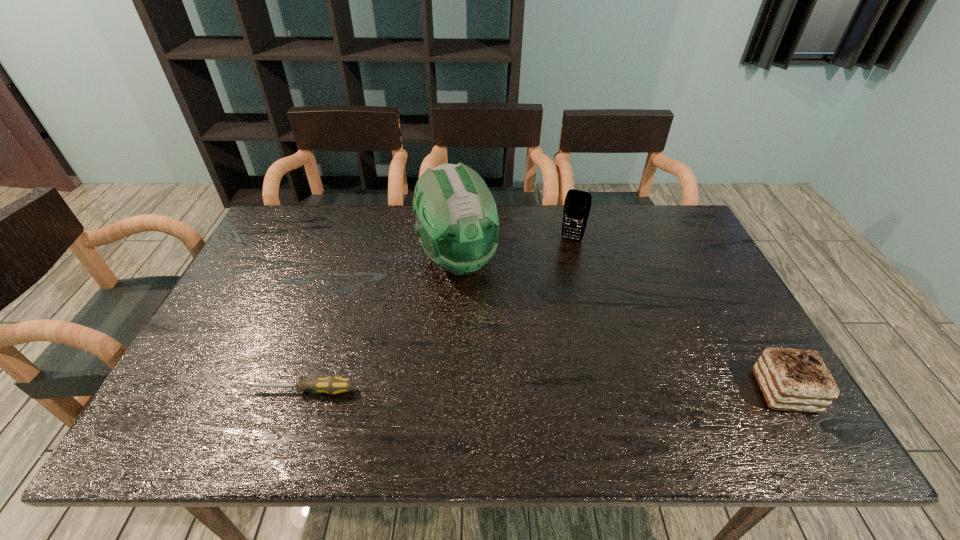
Identify the location of screwdriver located at the near edge. (332, 385).

The height and width of the screenshot is (540, 960). What are the coordinates of `chocolate cake located in the near edge section of the desktop` in the screenshot? It's located at (797, 380).

Locate an element on the screen. object located at the right edge is located at coordinates (797, 380).

This screenshot has height=540, width=960. What are the coordinates of `object present at the near right corner` in the screenshot? It's located at (797, 380).

In the image, there is a desktop. At what (x,y) coordinates should I click in order to perform the action: click on vacant space at the far edge. Please return your answer as a coordinate pair (x, y). The height and width of the screenshot is (540, 960). Looking at the image, I should click on (369, 222).

In the image, there is a desktop. Where is `vacant area at the near edge`? The width and height of the screenshot is (960, 540). vacant area at the near edge is located at coordinates (628, 375).

The height and width of the screenshot is (540, 960). In order to click on free region at the left edge of the desktop in this screenshot , I will do tap(253, 259).

The width and height of the screenshot is (960, 540). In order to click on vacant area at the right edge of the desktop in this screenshot , I will do `click(673, 258)`.

At what (x,y) coordinates should I click in order to perform the action: click on vacant space at the far left corner. Please return your answer as a coordinate pair (x, y). Looking at the image, I should click on click(x=259, y=248).

In the image, there is a desktop. At what (x,y) coordinates should I click in order to perform the action: click on vacant area at the far right corner. Please return your answer as a coordinate pair (x, y). The height and width of the screenshot is (540, 960). Looking at the image, I should click on (668, 215).